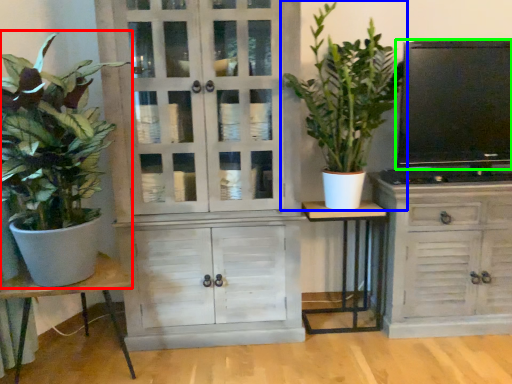
Question: Which object is the closest to the houseplant (highlighted by a red box)? Choose among these: houseplant (highlighted by a blue box) or television (highlighted by a green box).

Choices:
 (A) houseplant
 (B) television

Answer: (A)